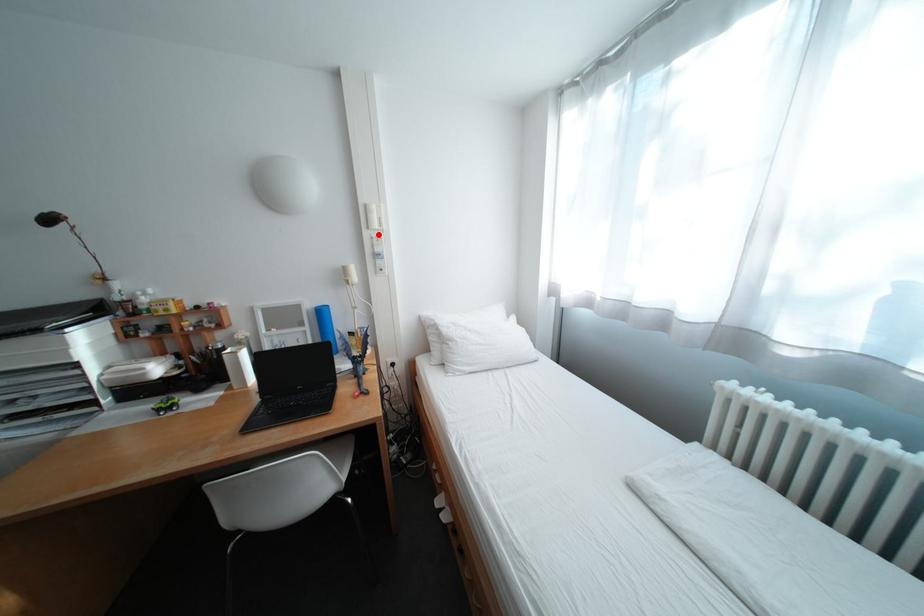
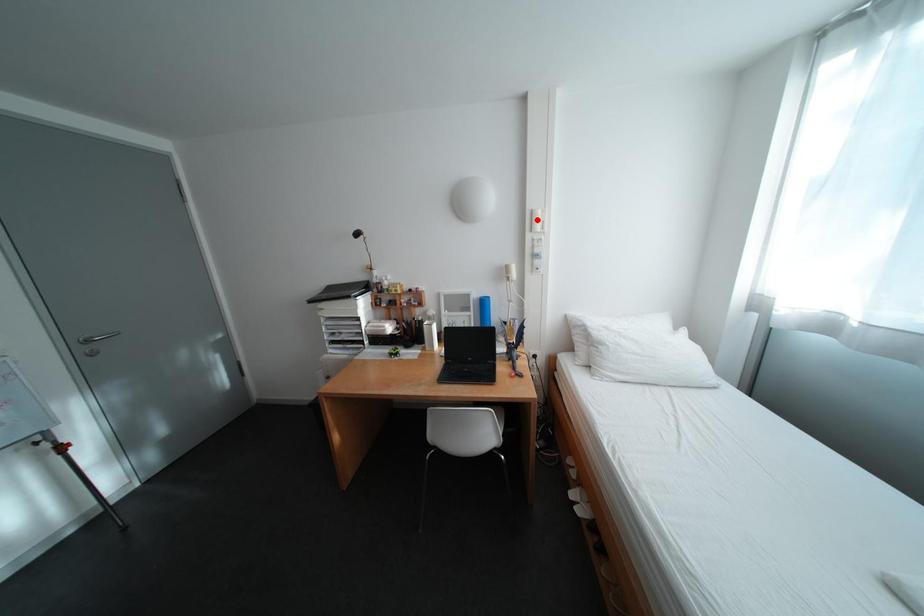
I am providing you with two images of the same scene from different viewpoints. A red point is marked on the first image and another point is marked on the second image. Are the points marked in image1 and image2 representing the same 3D position?

No